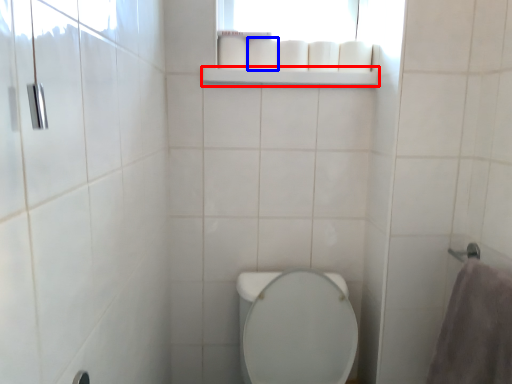
Question: Which point is further to the camera, balustrade (highlighted by a red box) or toilet paper (highlighted by a blue box)?

Choices:
 (A) balustrade
 (B) toilet paper

Answer: (B)